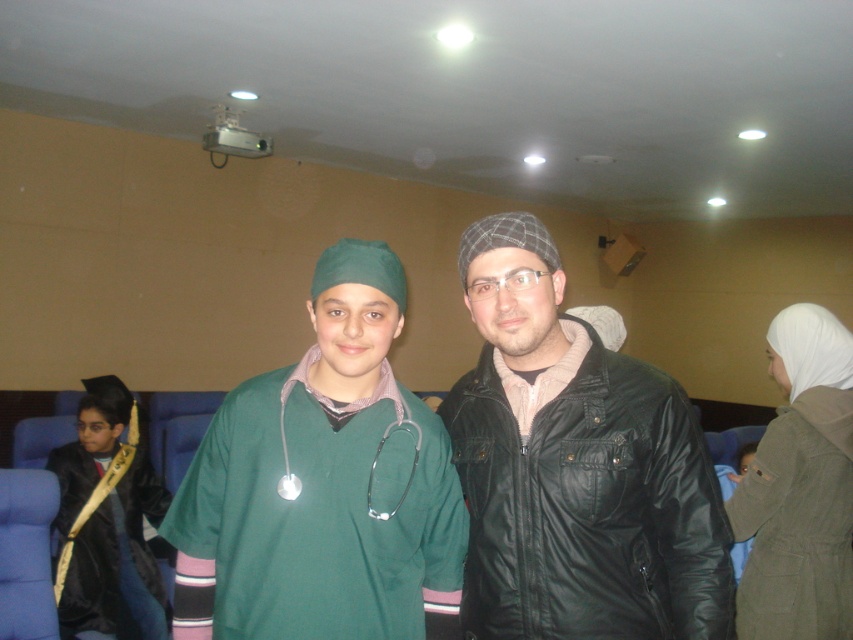
Who is higher up, black leather jacket at center or black satin graduation gown at lower left?

black leather jacket at center is above.

Can you confirm if black leather jacket at center is thinner than black satin graduation gown at lower left?

Correct, black leather jacket at center's width is less than black satin graduation gown at lower left's.

Who is more distant from viewer, (663, 490) or (74, 516)?

The point (74, 516) is more distant.

This screenshot has width=853, height=640. Find the location of `black leather jacket at center`. black leather jacket at center is located at coordinates (575, 467).

Does point (395, 492) lie behind point (70, 516)?

No, (395, 492) is in front of (70, 516).

Is point (244, 529) positioned in front of point (115, 627)?

Yes, it is.

Identify the location of green matte scrub at center. (318, 516).

Find the location of a particular element. Image resolution: width=853 pixels, height=640 pixels. green matte scrub at center is located at coordinates (318, 516).

Can you confirm if black leather jacket at center is taller than green matte scrub at center?

Correct, black leather jacket at center is much taller as green matte scrub at center.

Who is more distant from viewer, (665, 637) or (300, 499)?

Point (665, 637)

The height and width of the screenshot is (640, 853). What do you see at coordinates (575, 467) in the screenshot?
I see `black leather jacket at center` at bounding box center [575, 467].

The width and height of the screenshot is (853, 640). What are the coordinates of `black leather jacket at center` in the screenshot? It's located at (575, 467).